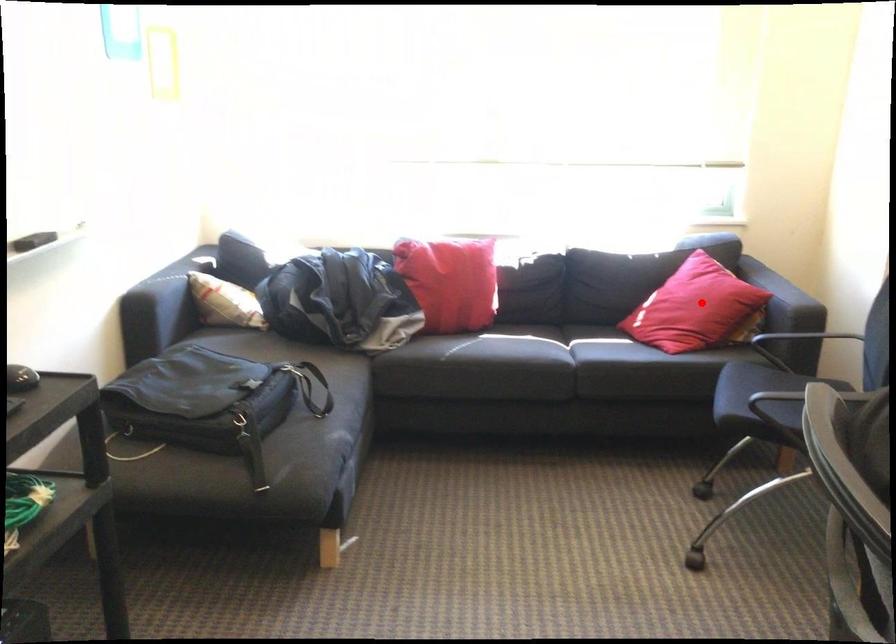
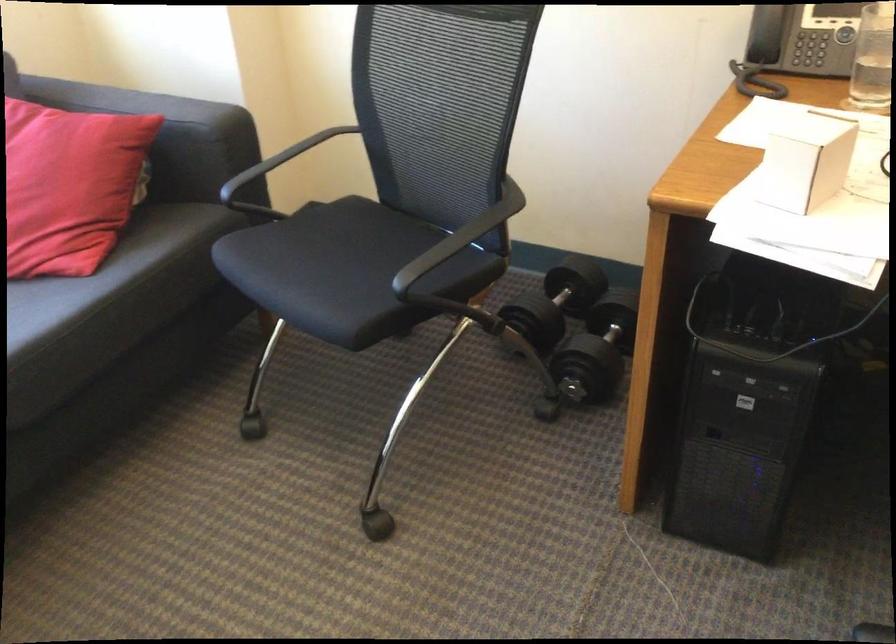
Locate, in the second image, the point that corresponds to the highlighted location in the first image.

(69, 185)